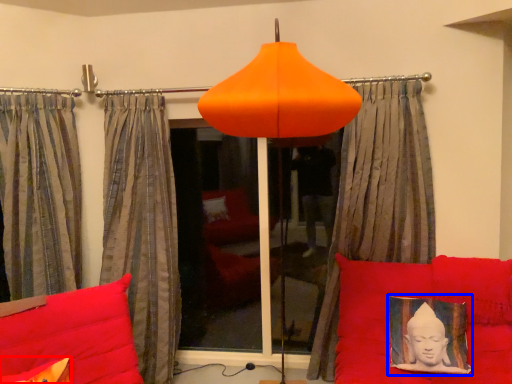
Question: Which object appears closest to the camera in this image, pillow (highlighted by a red box) or picture frame (highlighted by a blue box)?

Choices:
 (A) pillow
 (B) picture frame

Answer: (A)